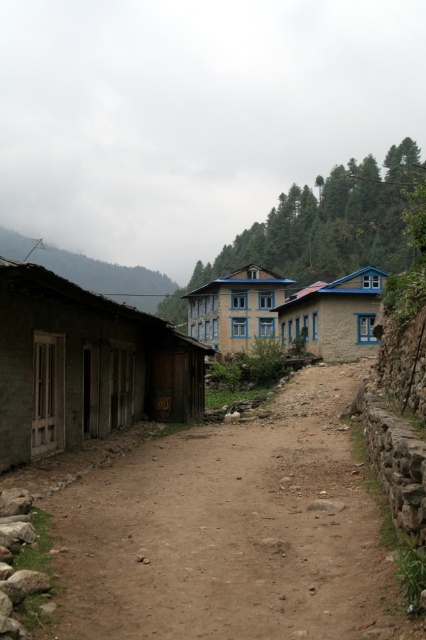
Which is behind, point (224, 461) or point (152, 289)?

Point (152, 289)

Does brown dirt track at center lie behind green grassy hillside at left?

No, it is not.

The width and height of the screenshot is (426, 640). What do you see at coordinates (230, 531) in the screenshot?
I see `brown dirt track at center` at bounding box center [230, 531].

Where is `brown dirt track at center`? brown dirt track at center is located at coordinates (230, 531).

Can you confirm if yellow stone building at center is shorter than green grassy hillside at left?

Indeed, yellow stone building at center has a lesser height compared to green grassy hillside at left.

The height and width of the screenshot is (640, 426). What do you see at coordinates (236, 308) in the screenshot? I see `yellow stone building at center` at bounding box center [236, 308].

Identify the location of yellow stone building at center. The image size is (426, 640). (236, 308).

Describe the element at coordinates (230, 531) in the screenshot. The height and width of the screenshot is (640, 426). I see `brown dirt track at center` at that location.

Is brown dirt track at center above dark gray concrete hut at left?

Incorrect, brown dirt track at center is not positioned above dark gray concrete hut at left.

Image resolution: width=426 pixels, height=640 pixels. Identify the location of brown dirt track at center. (230, 531).

Where is `brown dirt track at center`? The height and width of the screenshot is (640, 426). brown dirt track at center is located at coordinates [230, 531].